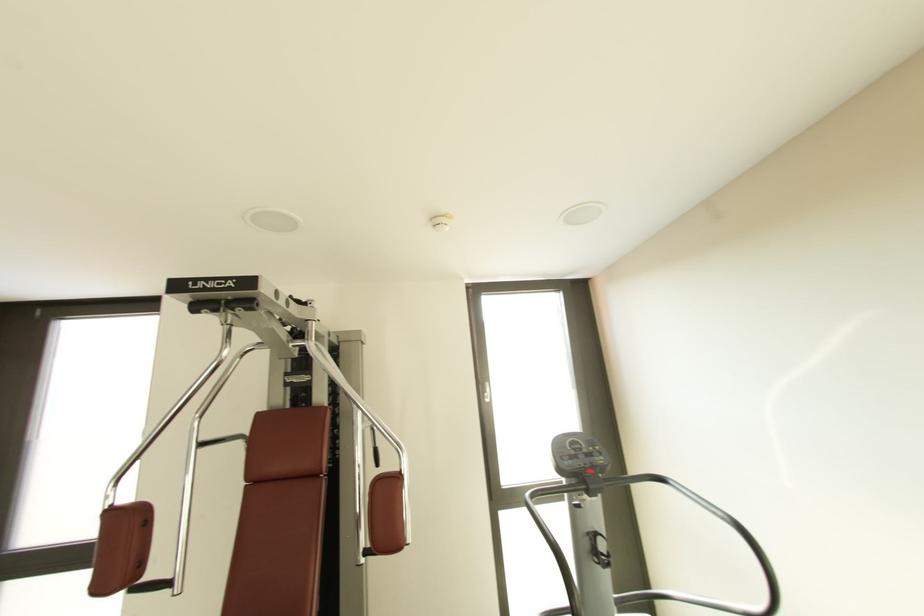
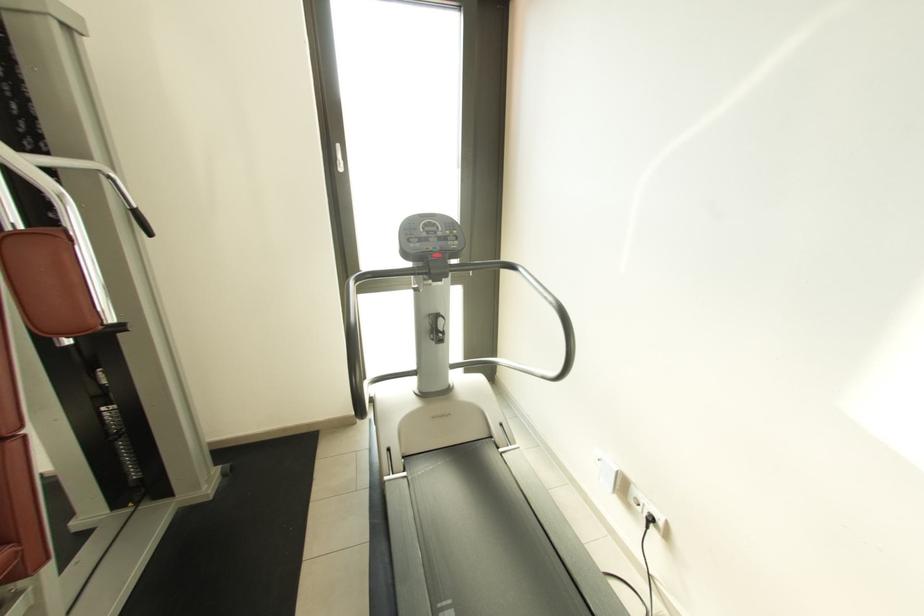
Question: I am providing you with two images of the same scene from different viewpoints. Please identify which objects are invisible in image2.

Choices:
 (A) machine safety rail
 (B) black machine grip
 (C) white door handle
 (D) none of these

Answer: (D)